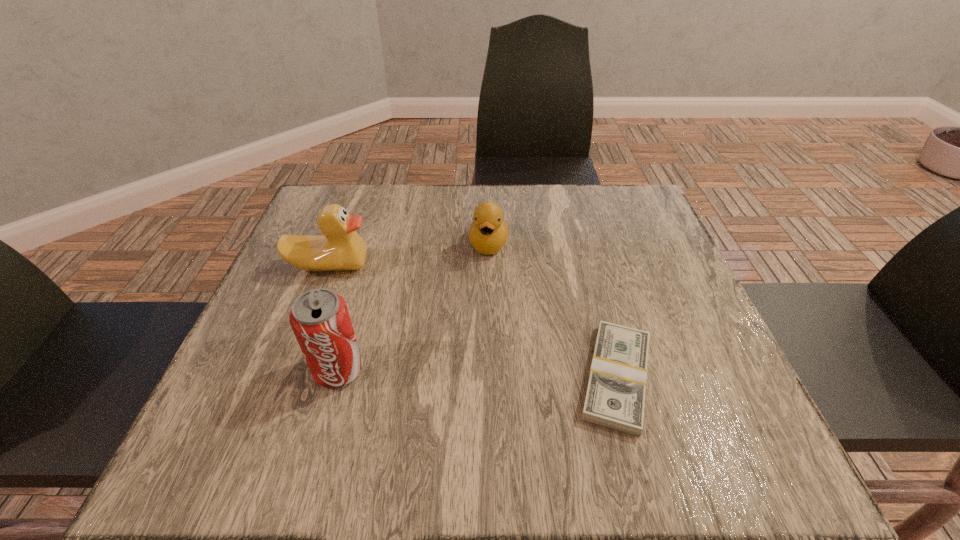
The image size is (960, 540). What are the coordinates of `vacant space situated 0.340m on the face of the second shortest object` in the screenshot? It's located at (473, 393).

Where is `vacant space situated at the beak of the duck`? vacant space situated at the beak of the duck is located at coordinates pyautogui.click(x=438, y=338).

Find the location of a particular element. This screenshot has height=540, width=960. free region located at the beak of the duck is located at coordinates (448, 347).

Find the location of `vacant space located at the beak of the duck`. vacant space located at the beak of the duck is located at coordinates (431, 333).

The height and width of the screenshot is (540, 960). I want to click on object that is at the far edge, so click(488, 233).

The width and height of the screenshot is (960, 540). I want to click on soda can present at the near edge, so click(x=319, y=318).

At what (x,y) coordinates should I click in order to perform the action: click on dollar present at the near edge. Please return your answer as a coordinate pair (x, y). Image resolution: width=960 pixels, height=540 pixels. Looking at the image, I should click on (615, 397).

Locate an element on the screen. The image size is (960, 540). soda can positioned at the left edge is located at coordinates (319, 318).

At what (x,y) coordinates should I click in order to perform the action: click on duck present at the left edge. Please return your answer as a coordinate pair (x, y). The height and width of the screenshot is (540, 960). Looking at the image, I should click on (341, 248).

Locate an element on the screen. The height and width of the screenshot is (540, 960). object that is at the right edge is located at coordinates (615, 397).